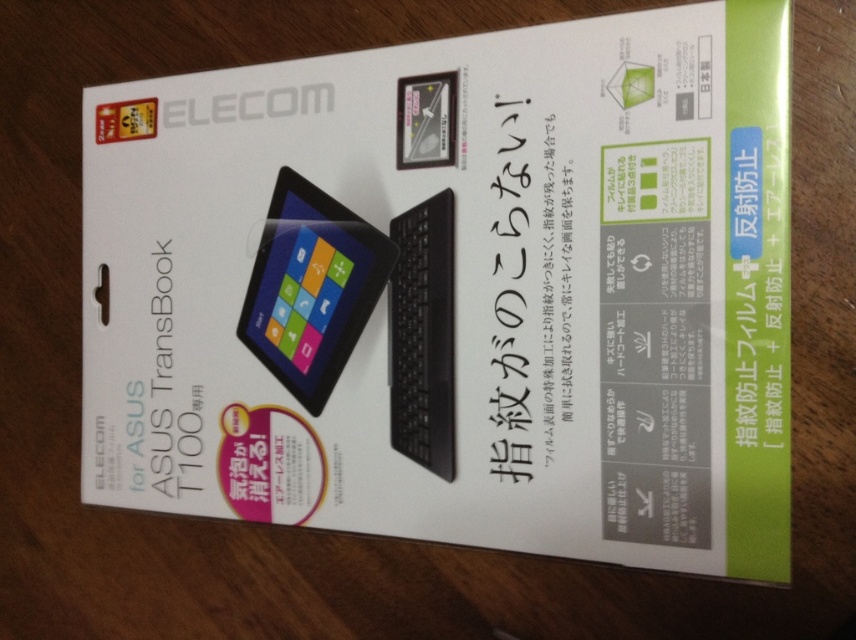
Question: Does matte black tablet at center have a lesser width compared to black matte keyboard at center?

Choices:
 (A) no
 (B) yes

Answer: (A)

Question: In this image, where is matte black tablet at center located relative to black matte keyboard at center?

Choices:
 (A) above
 (B) below

Answer: (A)

Question: Which of the following is the closest to the observer?

Choices:
 (A) (301, 304)
 (B) (394, 320)

Answer: (B)

Question: Is matte black tablet at center above black matte keyboard at center?

Choices:
 (A) yes
 (B) no

Answer: (A)